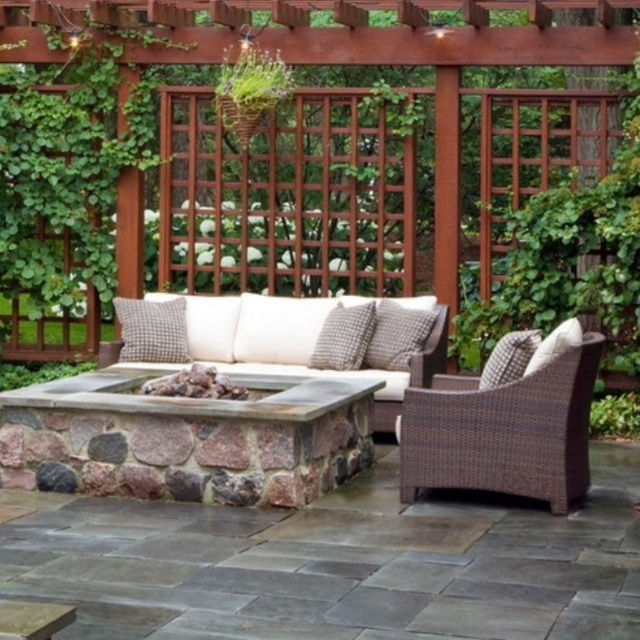
You are sitting on the wicker sofa and want to grab the white textured pillow at center. Which direction should you reach to get it compared to the woven fabric pillow at right?

The white textured pillow at center is located above the woven fabric pillow at right, so you should reach upward to get the white textured pillow at center compared to the woven fabric pillow at right.

You are planning to place a new table between the brown wicker chair at right and the white textured pillow at right. Based on their current positions, where should the table be placed to ensure it is between both objects?

The table should be placed between the brown wicker chair at right and the white textured pillow at right since the brown wicker chair at right is positioned under the white textured pillow at right, meaning the pillow is above the chair. Therefore, placing the table between them would require positioning it horizontally between their locations.